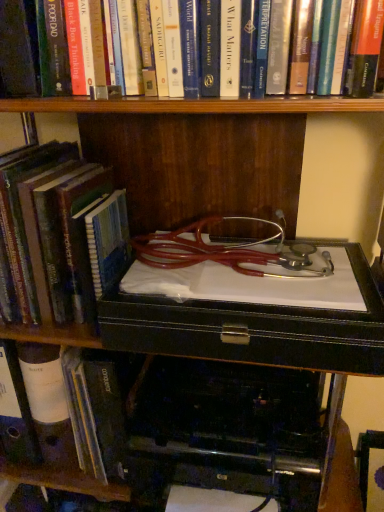
Question: From the image's perspective, is hardcover book at left, marked as the 2th book in a bottom-to-top arrangement, below hardcover book at left, which is the 1th book from bottom to top?

Choices:
 (A) no
 (B) yes

Answer: (A)

Question: Is the position of hardcover book at left, marked as the 2th book in a bottom-to-top arrangement, more distant than that of hardcover book at left, which is the 1th book from bottom to top?

Choices:
 (A) no
 (B) yes

Answer: (A)

Question: Considering the relative positions of hardcover book at left, marked as the 2th book in a bottom-to-top arrangement, and hardcover book at left, the 3th book viewed from the top, in the image provided, is hardcover book at left, marked as the 2th book in a bottom-to-top arrangement, to the left of hardcover book at left, the 3th book viewed from the top, from the viewer's perspective?

Choices:
 (A) no
 (B) yes

Answer: (A)

Question: Can you confirm if hardcover book at left, which is counted as the second book, starting from the top, is wider than hardcover book at left, which is the 1th book from bottom to top?

Choices:
 (A) yes
 (B) no

Answer: (B)

Question: Is the depth of hardcover book at left, marked as the 2th book in a bottom-to-top arrangement, less than that of hardcover book at left, which is the 1th book from bottom to top?

Choices:
 (A) yes
 (B) no

Answer: (A)

Question: Is hardcover book at left, which is counted as the second book, starting from the top, in contact with hardcover book at left, which is the 1th book from bottom to top?

Choices:
 (A) yes
 (B) no

Answer: (B)

Question: From a real-world perspective, is hardcover book at left, the 3th book viewed from the top, located beneath black plastic printer at lower center?

Choices:
 (A) yes
 (B) no

Answer: (B)

Question: Does hardcover book at left, which is the 1th book from bottom to top, lie behind black plastic printer at lower center?

Choices:
 (A) no
 (B) yes

Answer: (B)

Question: Is hardcover book at left, which is the 1th book from bottom to top, next to black plastic printer at lower center?

Choices:
 (A) yes
 (B) no

Answer: (B)

Question: From the image's perspective, is hardcover book at left, which is the 1th book from bottom to top, on top of black plastic printer at lower center?

Choices:
 (A) no
 (B) yes

Answer: (B)

Question: Is hardcover book at left, which is the 1th book from bottom to top, outside black plastic printer at lower center?

Choices:
 (A) no
 (B) yes

Answer: (B)

Question: Is hardcover book at left, which is the 1th book from bottom to top, positioned far away from black plastic printer at lower center?

Choices:
 (A) yes
 (B) no

Answer: (B)

Question: Is hardcover book at left, which is counted as the second book, starting from the top, wider than hardcover book at upper center, the 3th book from the bottom?

Choices:
 (A) yes
 (B) no

Answer: (A)